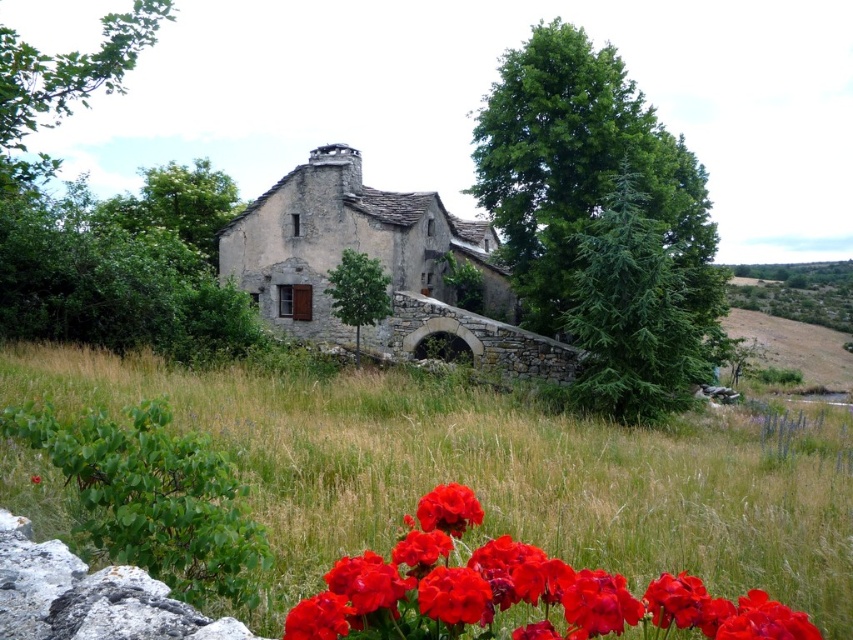
Question: Can you confirm if glossy red flowers at lower center is positioned to the right of matte red flower at lower center?

Choices:
 (A) yes
 (B) no

Answer: (A)

Question: Which point appears closest to the camera in this image?

Choices:
 (A) (675, 593)
 (B) (128, 355)
 (C) (456, 525)

Answer: (A)

Question: Which point appears farthest from the camera in this image?

Choices:
 (A) (653, 452)
 (B) (376, 636)
 (C) (425, 524)

Answer: (A)

Question: Which object is the farthest from the glossy red flowers at lower center?

Choices:
 (A) green grass at center
 (B) matte red flower at lower center

Answer: (A)

Question: Is glossy red flowers at lower center to the right of matte red flower at lower center from the viewer's perspective?

Choices:
 (A) yes
 (B) no

Answer: (A)

Question: Does glossy red flowers at lower center have a larger size compared to matte red flower at lower center?

Choices:
 (A) yes
 (B) no

Answer: (A)